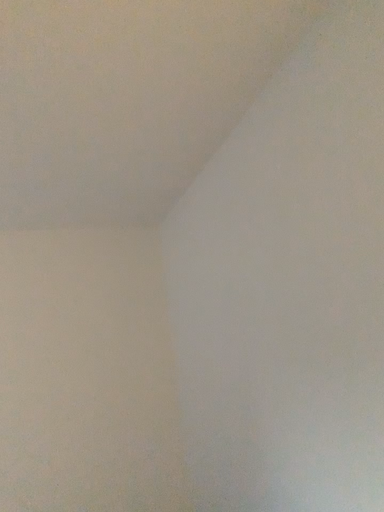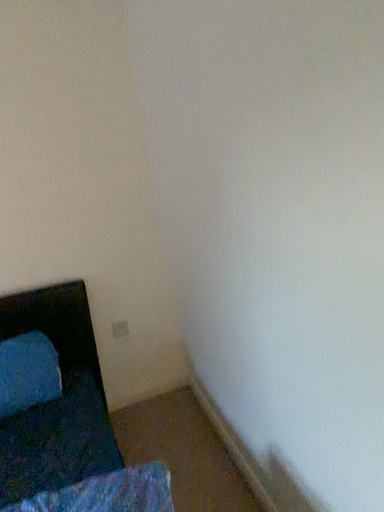
Question: How did the camera likely rotate when shooting the video?

Choices:
 (A) rotated upward
 (B) rotated downward

Answer: (B)